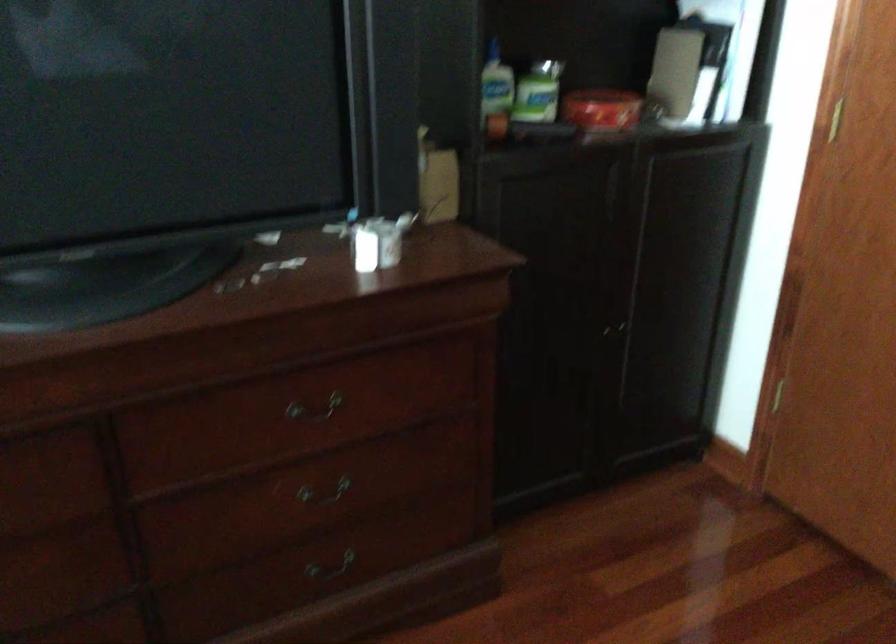
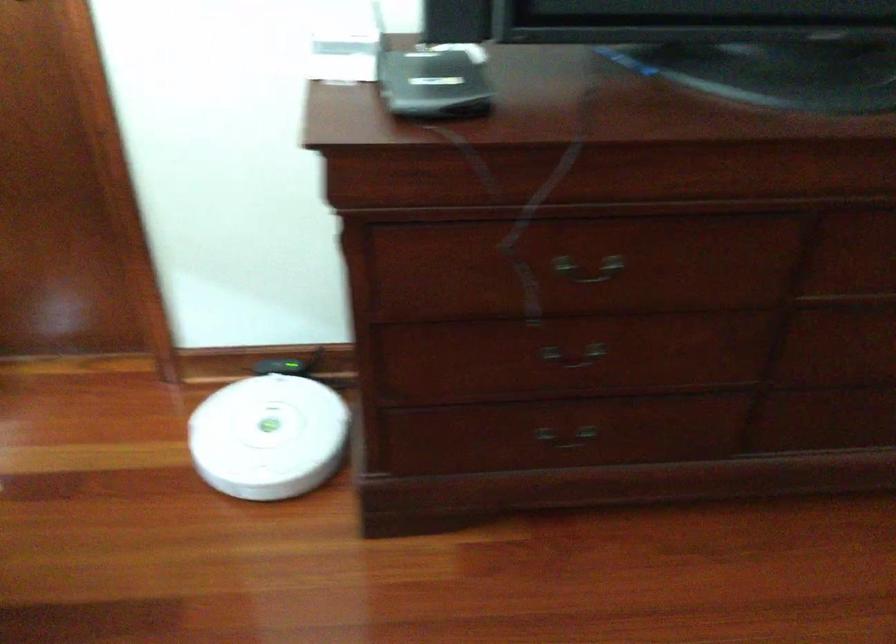
Question: How did the camera likely rotate?

Choices:
 (A) Left
 (B) Right
 (C) Up
 (D) Down

Answer: (A)